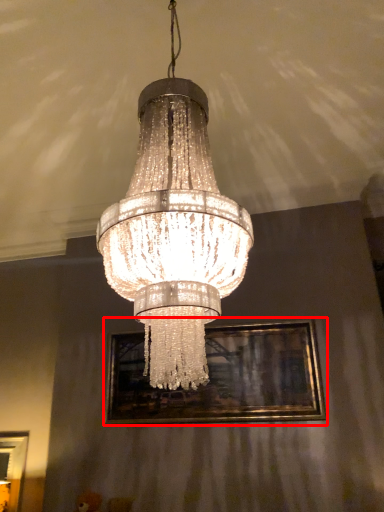
Question: From the image's perspective, what is the correct spatial positioning of picture frame (annotated by the red box) in reference to lamp?

Choices:
 (A) below
 (B) above

Answer: (A)